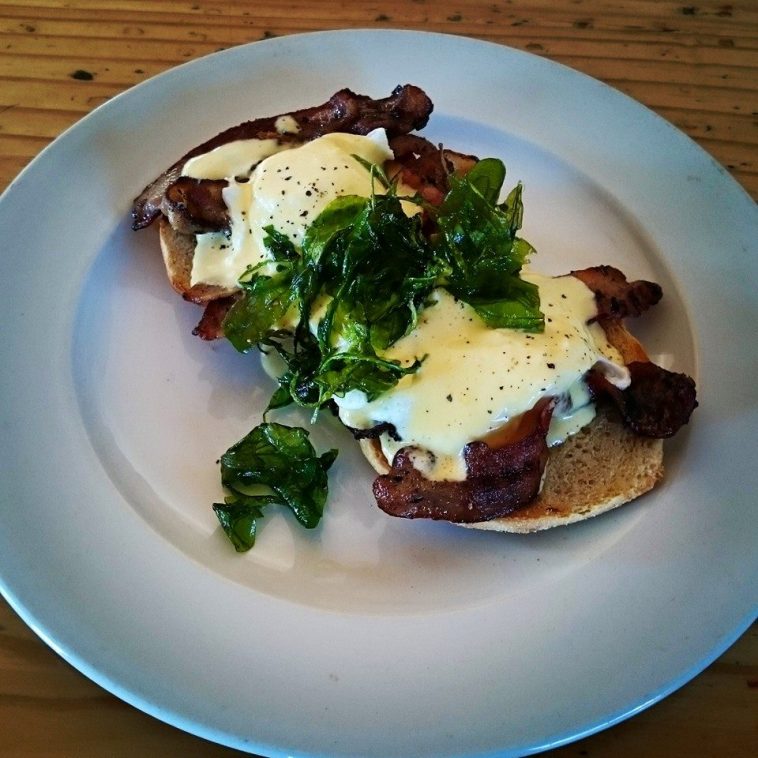
Identify the location of wooden table. This screenshot has height=758, width=758. (67, 77), (688, 60), (733, 716), (30, 715).